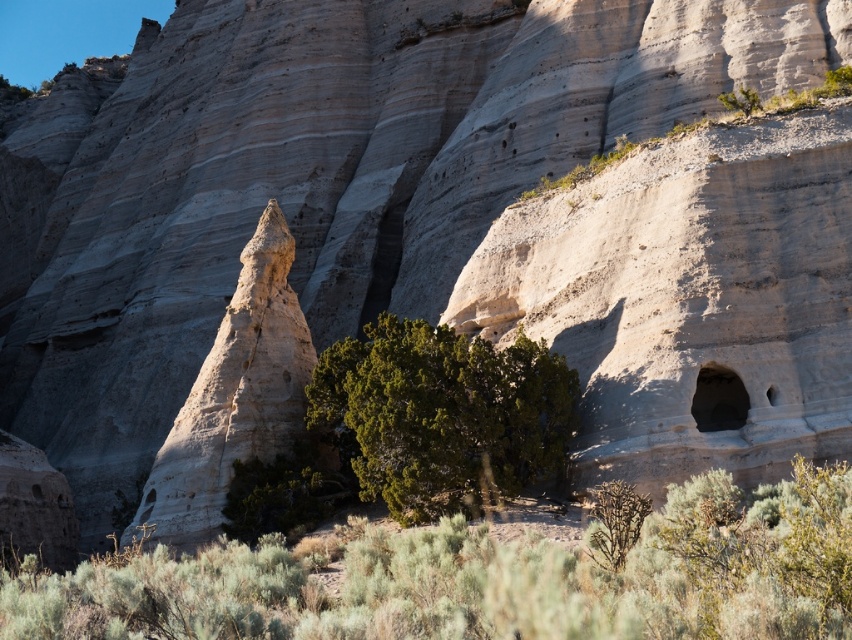
Does green shrubbery at center have a greater height compared to smooth gray rock at right?

Yes, green shrubbery at center is taller than smooth gray rock at right.

Is green shrubbery at center wider than smooth gray rock at right?

Indeed, green shrubbery at center has a greater width compared to smooth gray rock at right.

I want to click on green shrubbery at center, so click(485, 579).

Is green leafy bush at center positioned before smooth gray rock at right?

Yes.

Between point (521, 477) and point (737, 397), which one is positioned behind?

The point (737, 397) is behind.

Find the location of `green leafy bush at center`. green leafy bush at center is located at coordinates (442, 413).

Which is above, green shrubbery at center or green matte/juniper bush at lower center?

green matte/juniper bush at lower center is above.

Between point (389, 632) and point (636, 496), which one is positioned behind?

The point (636, 496) is more distant.

Where is `green shrubbery at center`? This screenshot has width=852, height=640. green shrubbery at center is located at coordinates (485, 579).